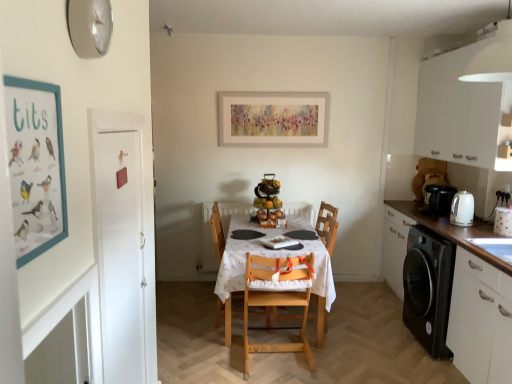
The width and height of the screenshot is (512, 384). Identify the location of vacant space in natural wood highchair at center, arranged as the first chair when viewed from the front (from a real-world perspective). (280, 358).